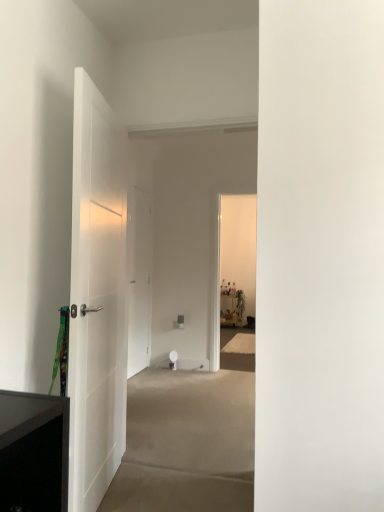
Question: Is white matte door at left, arranged as the first door when viewed from the front, far from white matte door at center, acting as the second door starting from the front?

Choices:
 (A) yes
 (B) no

Answer: (A)

Question: Is the position of white matte door at left, arranged as the first door when viewed from the front, more distant than that of white matte door at center, which ranks as the first door in back-to-front order?

Choices:
 (A) yes
 (B) no

Answer: (B)

Question: From a real-world perspective, does white matte door at left, arranged as the first door when viewed from the front, sit lower than white matte door at center, which ranks as the first door in back-to-front order?

Choices:
 (A) no
 (B) yes

Answer: (B)

Question: Is white matte door at left, arranged as the first door when viewed from the front, touching white matte door at center, which ranks as the first door in back-to-front order?

Choices:
 (A) yes
 (B) no

Answer: (B)

Question: Does white matte door at left, arranged as the first door when viewed from the front, have a lesser height compared to white matte door at center, acting as the second door starting from the front?

Choices:
 (A) yes
 (B) no

Answer: (B)

Question: Considering the relative positions of white matte door at left, arranged as the first door when viewed from the front, and white matte door at center, acting as the second door starting from the front, in the image provided, is white matte door at left, arranged as the first door when viewed from the front, to the left of white matte door at center, acting as the second door starting from the front, from the viewer's perspective?

Choices:
 (A) no
 (B) yes

Answer: (A)

Question: Considering the relative sizes of white matte door at center, acting as the second door starting from the front, and white matte door at left, the second door viewed from the back, in the image provided, is white matte door at center, acting as the second door starting from the front, bigger than white matte door at left, the second door viewed from the back,?

Choices:
 (A) yes
 (B) no

Answer: (B)

Question: Considering the relative positions of white matte door at center, acting as the second door starting from the front, and white matte door at left, the second door viewed from the back, in the image provided, is white matte door at center, acting as the second door starting from the front, in front of white matte door at left, the second door viewed from the back,?

Choices:
 (A) no
 (B) yes

Answer: (A)

Question: Is the surface of white matte door at center, acting as the second door starting from the front, in direct contact with white matte door at left, arranged as the first door when viewed from the front?

Choices:
 (A) no
 (B) yes

Answer: (A)

Question: Is white matte door at center, which ranks as the first door in back-to-front order, thinner than white matte door at left, the second door viewed from the back?

Choices:
 (A) yes
 (B) no

Answer: (A)

Question: Are white matte door at center, which ranks as the first door in back-to-front order, and white matte door at left, arranged as the first door when viewed from the front, far apart?

Choices:
 (A) yes
 (B) no

Answer: (A)

Question: Is white matte door at center, acting as the second door starting from the front, not inside white matte door at left, arranged as the first door when viewed from the front?

Choices:
 (A) no
 (B) yes

Answer: (B)

Question: From the image's perspective, is white matte door at left, arranged as the first door when viewed from the front, positioned above or below white matte door at center, acting as the second door starting from the front?

Choices:
 (A) above
 (B) below

Answer: (A)